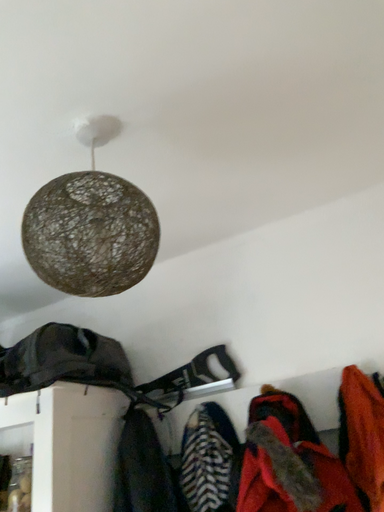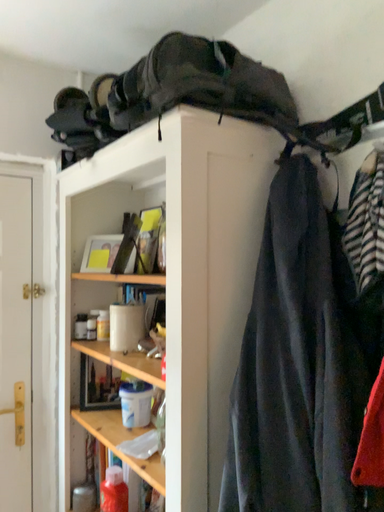
Question: How did the camera likely rotate when shooting the video?

Choices:
 (A) rotated downward
 (B) rotated upward

Answer: (A)